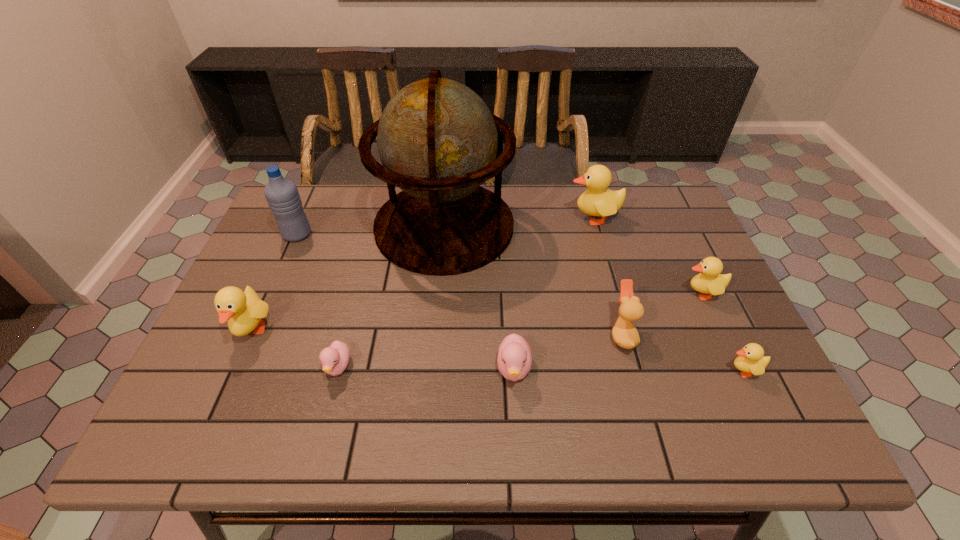
Locate an element on the screen. This screenshot has width=960, height=540. empty location between the tan duck and the bigger pink duckling is located at coordinates (567, 352).

Find the location of a particular element. blank region between the third nearest yellow duckling and the nearest yellow duckling is located at coordinates (722, 332).

The height and width of the screenshot is (540, 960). Find the location of `object that is the closest to the shortest duckling`. object that is the closest to the shortest duckling is located at coordinates (244, 310).

The height and width of the screenshot is (540, 960). Find the location of `the eighth closest object to the shortest object`. the eighth closest object to the shortest object is located at coordinates (751, 361).

The height and width of the screenshot is (540, 960). I want to click on the closest duckling to the second tallest object, so [244, 310].

Select which duckling is the second closest to the leftmost duckling. Please provide its 2D coordinates. Your answer should be formatted as a tuple, i.e. [(x, y)], where the tuple contains the x and y coordinates of a point satisfying the conditions above.

[(514, 359)]

Choose which yellow duckling is the nearest neighbor to the second farthest duckling. Please provide its 2D coordinates. Your answer should be formatted as a tuple, i.e. [(x, y)], where the tuple contains the x and y coordinates of a point satisfying the conditions above.

[(751, 361)]

Choose which yellow duckling is the second nearest neighbor to the third biggest yellow duckling. Please provide its 2D coordinates. Your answer should be formatted as a tuple, i.e. [(x, y)], where the tuple contains the x and y coordinates of a point satisfying the conditions above.

[(597, 200)]

The width and height of the screenshot is (960, 540). Find the location of `free space that satisfies the following two spatial constraints: 1. on the front-facing side of the biggest yellow duckling; 2. on the front-facing side of the right pink duckling`. free space that satisfies the following two spatial constraints: 1. on the front-facing side of the biggest yellow duckling; 2. on the front-facing side of the right pink duckling is located at coordinates (636, 369).

The width and height of the screenshot is (960, 540). I want to click on free spot that satisfies the following two spatial constraints: 1. on the beak of the duck; 2. on the front-facing side of the right pink duckling, so click(631, 369).